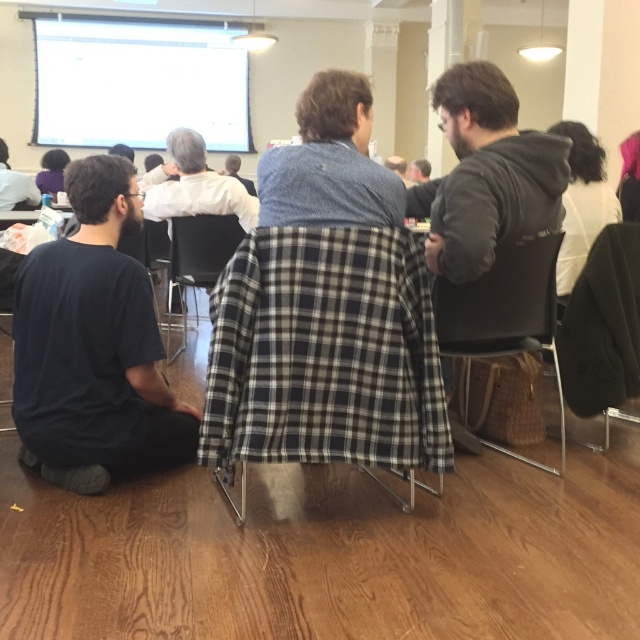
Can you confirm if white matte projector screen at upper center is thinner than white shirt at center?

No, white matte projector screen at upper center is not thinner than white shirt at center.

Is point (49, 33) closer to viewer compared to point (189, 211)?

No, (49, 33) is further to viewer.

Where is `white matte projector screen at upper center`? white matte projector screen at upper center is located at coordinates (138, 83).

Is dark gray hoodie at center in front of black fabric chair at right?

Yes, it is.

Between point (454, 212) and point (586, 310), which one is positioned behind?

The point (586, 310) is more distant.

Is point (451, 372) positioned before point (627, 284)?

No, it is not.

This screenshot has height=640, width=640. What are the coordinates of `dark gray hoodie at center` in the screenshot? It's located at (486, 173).

Is black plaid fabric at center to the right of plaid fabric chair at center from the viewer's perspective?

Correct, you'll find black plaid fabric at center to the right of plaid fabric chair at center.

Between black plaid fabric at center and plaid fabric chair at center, which one is positioned higher?

Positioned higher is plaid fabric chair at center.

The height and width of the screenshot is (640, 640). What do you see at coordinates (323, 355) in the screenshot?
I see `black plaid fabric at center` at bounding box center [323, 355].

Locate an element on the screen. Image resolution: width=640 pixels, height=640 pixels. black plaid fabric at center is located at coordinates (323, 355).